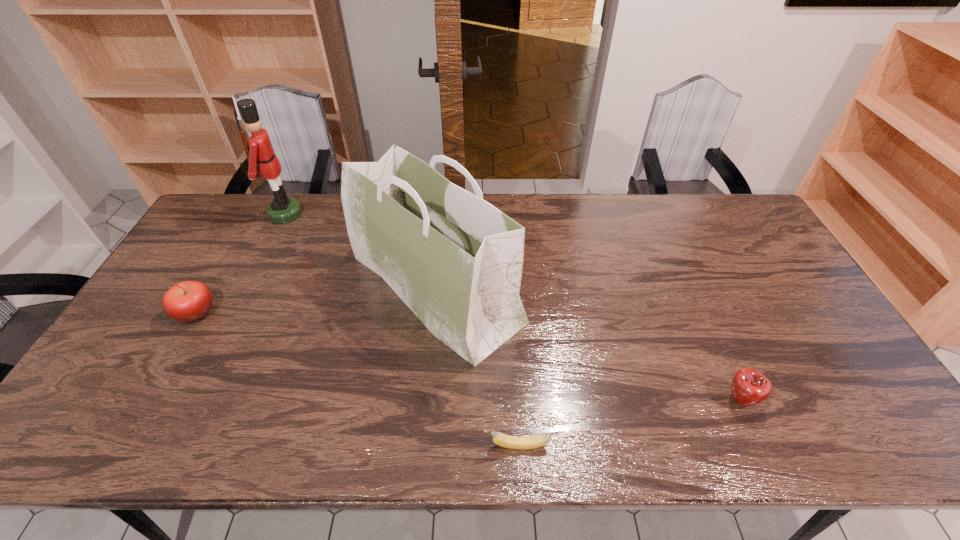
Identify the location of vacant space located 0.300m on the back of the right apple. (694, 295).

The image size is (960, 540). Find the location of `vacant space situated 0.340m at the stem of the nearest object`. vacant space situated 0.340m at the stem of the nearest object is located at coordinates (332, 445).

At what (x,y) coordinates should I click in order to perform the action: click on free region located at the stem of the nearest object. Please return your answer as a coordinate pair (x, y). Looking at the image, I should click on (430, 445).

You are a GUI agent. You are given a task and a screenshot of the screen. Output one action in this format:
    pyautogui.click(x=<x>, y=<y>)
    Task: Click on the vacant space located 0.080m at the stem of the nearest object
    Image resolution: width=960 pixels, height=540 pixels.
    Given the screenshot: What is the action you would take?
    pyautogui.click(x=448, y=445)

The image size is (960, 540). In order to click on nutcracker present at the far edge in this screenshot , I will do `click(259, 149)`.

Identify the location of grocery bag at the far edge. (456, 261).

I want to click on object that is positioned at the near edge, so click(507, 441).

Find the location of a particular element. object that is positioned at the left edge is located at coordinates (187, 301).

In the image, there is a desktop. Where is `vacant space at the far edge`? This screenshot has height=540, width=960. vacant space at the far edge is located at coordinates (543, 232).

At what (x,y) coordinates should I click in order to perform the action: click on vacant space at the near edge. Please return your answer as a coordinate pair (x, y). The width and height of the screenshot is (960, 540). Looking at the image, I should click on (698, 432).